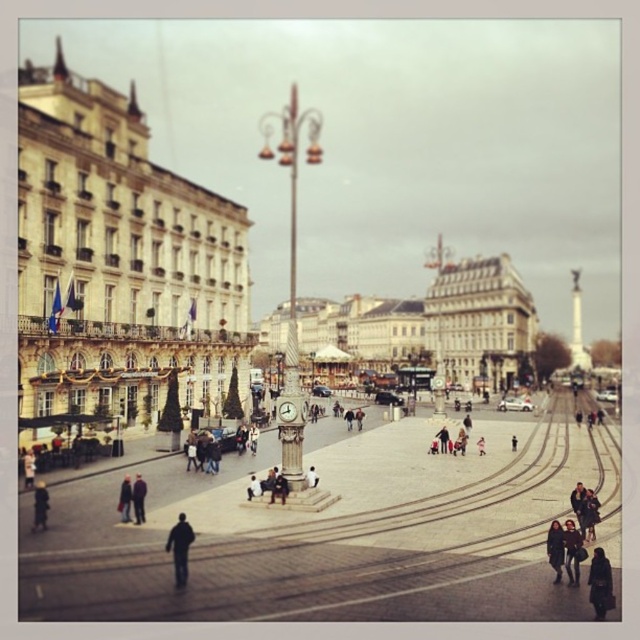
You are a photographer trying to capture both the dark blue coat at lower right and the dark blue jacket at lower right in a single frame. Since they are both at the lower right, which one should you adjust your camera angle to focus on first to ensure both are visible?

You should focus on the dark blue coat at lower right first because it is positioned to the left of the dark blue jacket at lower right, allowing you to frame them both by centering the camera between their positions.

You are standing in the urban square and notice two people wearing a dark brown coat at lower right and dark blue jeans at center. Which person is positioned more to the right side of the square?

The dark brown coat at lower right is positioned more to the right side of the square than the dark blue jeans at center.